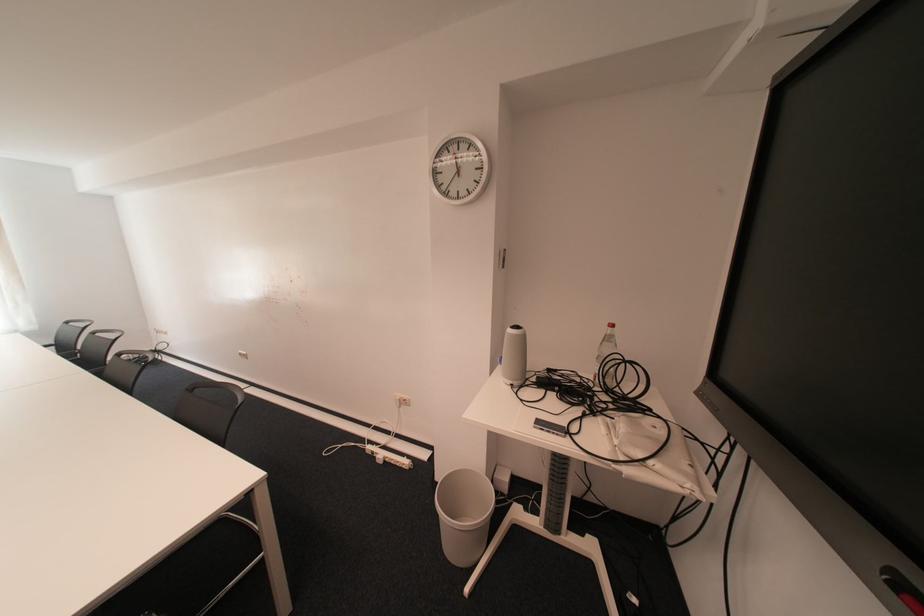
Which object does [514,355] point to?

It corresponds to the grey cylindrical speaker in the image.